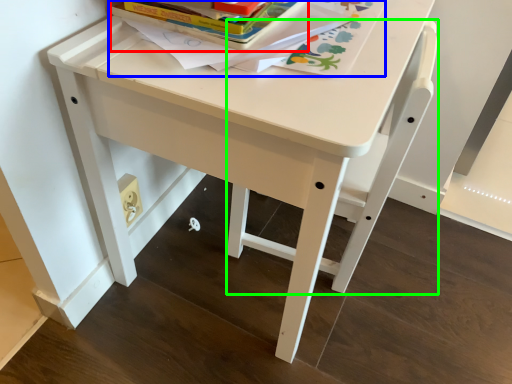
Question: Which is farther away from paperback book (highlighted by a red box)? book (highlighted by a blue box) or chair (highlighted by a green box)?

Choices:
 (A) book
 (B) chair

Answer: (B)